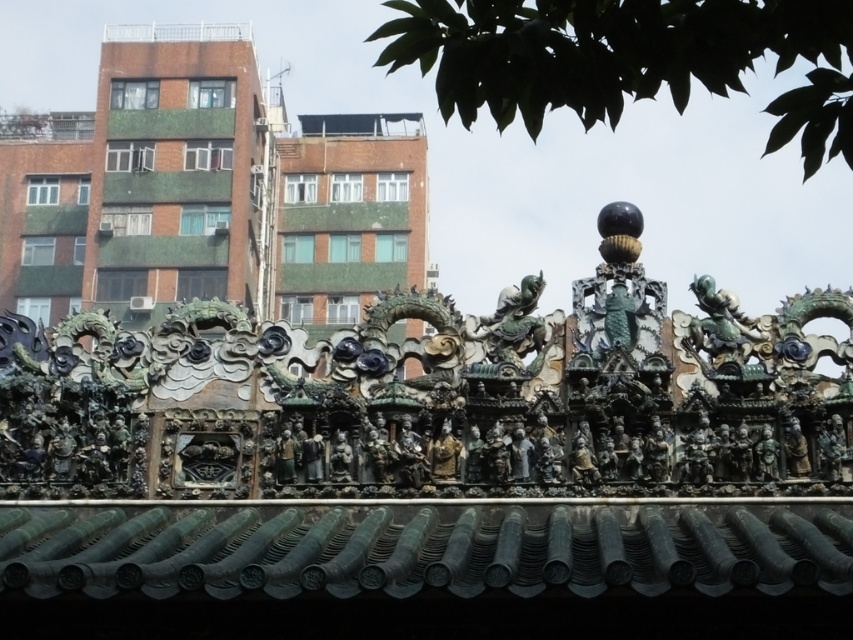
Can you confirm if green patinated metal dragon at center is positioned above bronze statue at center?

Correct, green patinated metal dragon at center is located above bronze statue at center.

Describe the element at coordinates (514, 324) in the screenshot. I see `green patinated metal dragon at center` at that location.

You are a GUI agent. You are given a task and a screenshot of the screen. Output one action in this format:
    pyautogui.click(x=<x>, y=<y>)
    Task: Click on the green patinated metal dragon at center
    
    Given the screenshot: What is the action you would take?
    pyautogui.click(x=514, y=324)

Who is positioned more to the right, green glazed tiles at upper center or bronze statue at center?

Positioned to the right is bronze statue at center.

Does point (154, 136) come farther from viewer compared to point (447, 465)?

Yes, point (154, 136) is farther from viewer.

Locate an element on the screen. This screenshot has height=640, width=853. green glazed tiles at upper center is located at coordinates (206, 192).

Who is higher up, green patinated metal figure at upper right or bronze statue at center?

Positioned higher is green patinated metal figure at upper right.

The height and width of the screenshot is (640, 853). In order to click on green patinated metal figure at upper right in this screenshot , I will do `click(720, 324)`.

This screenshot has height=640, width=853. I want to click on green patinated metal figure at upper right, so click(x=720, y=324).